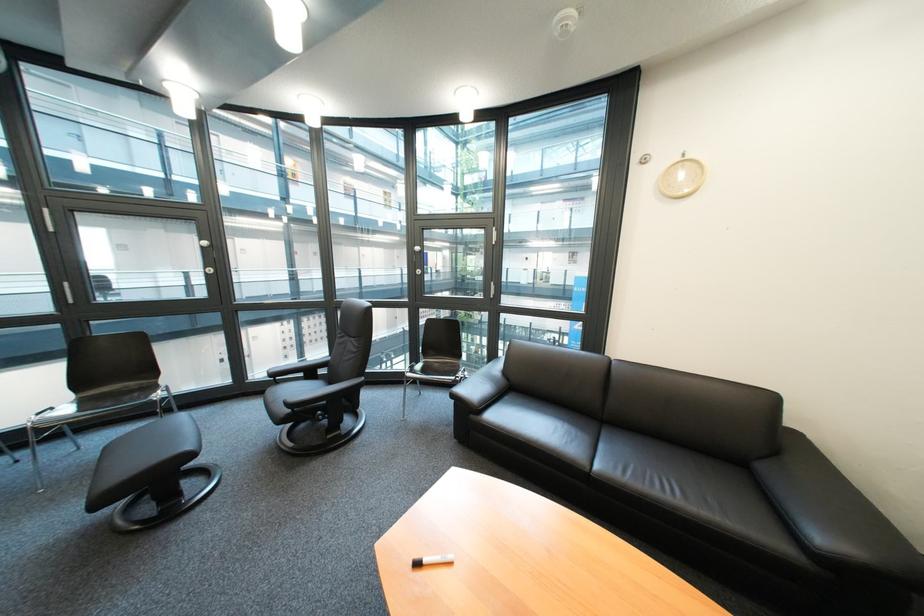
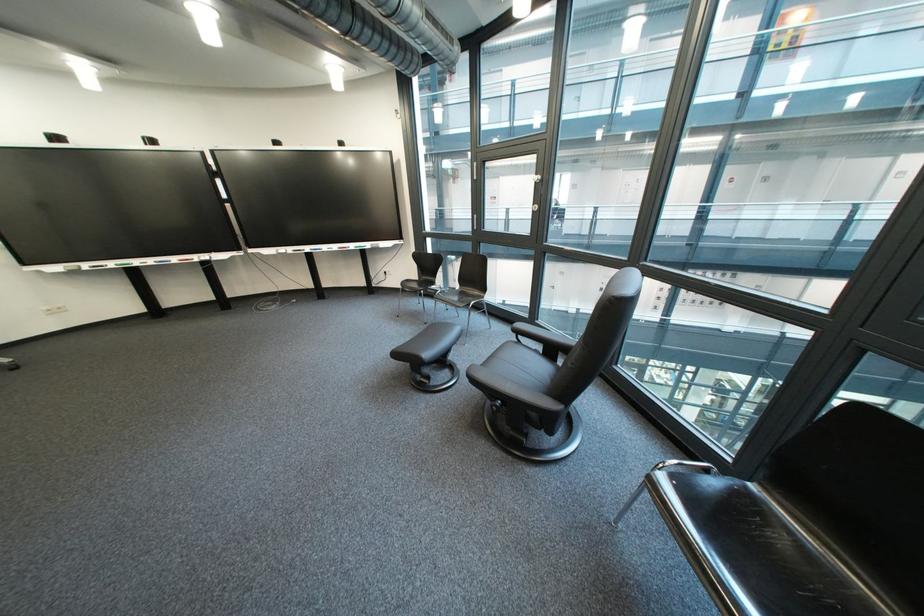
In the second image, find the point that corresponds to point 432,408 in the first image.

(684, 545)